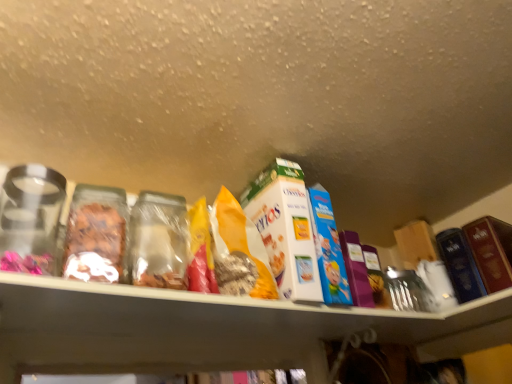
The height and width of the screenshot is (384, 512). What are the coordinates of `white cardboard cereal box at center, which appears as the 2th product when viewed from the right` in the screenshot? It's located at (285, 228).

Measure the distance between point (280, 235) and camera.

Point (280, 235) and camera are 3.29 feet apart from each other.

I want to click on hardcover book at right, acting as the 2th product starting from the left, so click(490, 251).

Is white cardboard cereal box at center, which is counted as the first product, starting from the left, not close to hardcover book at right, marked as the 1th product in a right-to-left arrangement?

No, there isn't a large distance between white cardboard cereal box at center, which is counted as the first product, starting from the left, and hardcover book at right, marked as the 1th product in a right-to-left arrangement.

From a real-world perspective, is white cardboard cereal box at center, which appears as the 2th product when viewed from the right, on hardcover book at right, marked as the 1th product in a right-to-left arrangement?

Yes, from a real-world perspective, white cardboard cereal box at center, which appears as the 2th product when viewed from the right, is above hardcover book at right, marked as the 1th product in a right-to-left arrangement.

Which of these two, white cardboard cereal box at center, which is counted as the first product, starting from the left, or hardcover book at right, marked as the 1th product in a right-to-left arrangement, is bigger?

white cardboard cereal box at center, which is counted as the first product, starting from the left, is bigger.

Can you tell me how much yellow paper bag at center and hardcover book at right, acting as the 2th product starting from the left, differ in facing direction?

The angle between the facing direction of yellow paper bag at center and the facing direction of hardcover book at right, acting as the 2th product starting from the left, is 83.8 degrees.

Is yellow paper bag at center wider than hardcover book at right, marked as the 1th product in a right-to-left arrangement?

No.

Is yellow paper bag at center beside hardcover book at right, marked as the 1th product in a right-to-left arrangement?

yellow paper bag at center is not next to hardcover book at right, marked as the 1th product in a right-to-left arrangement, and they're not touching.

From the image's perspective, count 2nd products downward from the yellow paper bag at center and point to it. Please provide its 2D coordinates.

[(490, 251)]

Where is `cereal above the white cardboard cereal box at center, which is counted as the first product, starting from the left (from the image's perspective)`? Image resolution: width=512 pixels, height=384 pixels. cereal above the white cardboard cereal box at center, which is counted as the first product, starting from the left (from the image's perspective) is located at coordinates (242, 241).

From a real-world perspective, is white cardboard cereal box at center, which appears as the 2th product when viewed from the right, positioned above or below yellow paper bag at center?

Clearly, from a real-world perspective, white cardboard cereal box at center, which appears as the 2th product when viewed from the right, is above yellow paper bag at center.

Does white cardboard cereal box at center, which appears as the 2th product when viewed from the right, come behind yellow paper bag at center?

Yes, white cardboard cereal box at center, which appears as the 2th product when viewed from the right, is further from the viewer.

Considering the relative sizes of white cardboard cereal box at center, which is counted as the first product, starting from the left, and yellow paper bag at center in the image provided, is white cardboard cereal box at center, which is counted as the first product, starting from the left, taller than yellow paper bag at center?

Indeed, white cardboard cereal box at center, which is counted as the first product, starting from the left, has a greater height compared to yellow paper bag at center.

The height and width of the screenshot is (384, 512). I want to click on cereal below the white cardboard cereal box at center, which is counted as the first product, starting from the left (from a real-world perspective), so click(x=242, y=241).

Is yellow paper bag at center not inside white cardboard cereal box at center, which appears as the 2th product when viewed from the right?

yellow paper bag at center is positioned outside white cardboard cereal box at center, which appears as the 2th product when viewed from the right.

Is point (249, 251) positioned after point (312, 286)?

No, (249, 251) is in front of (312, 286).

Is yellow paper bag at center aimed at white cardboard cereal box at center, which is counted as the first product, starting from the left?

No, yellow paper bag at center is not facing towards white cardboard cereal box at center, which is counted as the first product, starting from the left.

From the picture: Is hardcover book at right, acting as the 2th product starting from the left, inside or outside of yellow paper bag at center?

hardcover book at right, acting as the 2th product starting from the left, is spatially situated outside yellow paper bag at center.

From a real-world perspective, is hardcover book at right, acting as the 2th product starting from the left, positioned under yellow paper bag at center based on gravity?

Yes, from a real-world perspective, hardcover book at right, acting as the 2th product starting from the left, is under yellow paper bag at center.

Does point (496, 221) appear closer or farther from the camera than point (264, 255)?

Clearly, point (496, 221) is more distant from the camera than point (264, 255).

Is hardcover book at right, acting as the 2th product starting from the left, facing away from yellow paper bag at center?

No, hardcover book at right, acting as the 2th product starting from the left,'s orientation is not away from yellow paper bag at center.

Based on their positions, is hardcover book at right, marked as the 1th product in a right-to-left arrangement, located to the left or right of white cardboard cereal box at center, which is counted as the first product, starting from the left?

Clearly, hardcover book at right, marked as the 1th product in a right-to-left arrangement, is on the right of white cardboard cereal box at center, which is counted as the first product, starting from the left, in the image.

Consider the image. From the image's perspective, would you say hardcover book at right, acting as the 2th product starting from the left, is shown under white cardboard cereal box at center, which is counted as the first product, starting from the left?

Correct, hardcover book at right, acting as the 2th product starting from the left, appears lower than white cardboard cereal box at center, which is counted as the first product, starting from the left, in the image.

Between hardcover book at right, marked as the 1th product in a right-to-left arrangement, and white cardboard cereal box at center, which appears as the 2th product when viewed from the right, which one has less height?

hardcover book at right, marked as the 1th product in a right-to-left arrangement.

Between hardcover book at right, marked as the 1th product in a right-to-left arrangement, and white cardboard cereal box at center, which appears as the 2th product when viewed from the right, which one is positioned in front?

white cardboard cereal box at center, which appears as the 2th product when viewed from the right, is in front.

In order to click on product located on the left of hardcover book at right, marked as the 1th product in a right-to-left arrangement in this screenshot , I will do `click(285, 228)`.

The image size is (512, 384). I want to click on cereal in front of the hardcover book at right, acting as the 2th product starting from the left, so coord(242,241).

Which object lies nearer to the anchor point hardcover book at right, acting as the 2th product starting from the left, white cardboard cereal box at center, which appears as the 2th product when viewed from the right, or yellow paper bag at center?

white cardboard cereal box at center, which appears as the 2th product when viewed from the right, lies closer to hardcover book at right, acting as the 2th product starting from the left, than the other object.

Which object lies nearer to the anchor point yellow paper bag at center, hardcover book at right, acting as the 2th product starting from the left, or white cardboard cereal box at center, which is counted as the first product, starting from the left?

The object closer to yellow paper bag at center is white cardboard cereal box at center, which is counted as the first product, starting from the left.

Looking at this image, estimate the real-world distances between objects in this image. Which object is closer to hardcover book at right, marked as the 1th product in a right-to-left arrangement, yellow paper bag at center or white cardboard cereal box at center, which is counted as the first product, starting from the left?

white cardboard cereal box at center, which is counted as the first product, starting from the left, lies closer to hardcover book at right, marked as the 1th product in a right-to-left arrangement, than the other object.

Based on their spatial positions, is yellow paper bag at center or hardcover book at right, acting as the 2th product starting from the left, further from white cardboard cereal box at center, which is counted as the first product, starting from the left?

The object further to white cardboard cereal box at center, which is counted as the first product, starting from the left, is hardcover book at right, acting as the 2th product starting from the left.

Which object lies further to the anchor point white cardboard cereal box at center, which appears as the 2th product when viewed from the right, hardcover book at right, marked as the 1th product in a right-to-left arrangement, or yellow paper bag at center?

Based on the image, hardcover book at right, marked as the 1th product in a right-to-left arrangement, appears to be further to white cardboard cereal box at center, which appears as the 2th product when viewed from the right.

From the image, which object appears to be farther from yellow paper bag at center, white cardboard cereal box at center, which is counted as the first product, starting from the left, or hardcover book at right, acting as the 2th product starting from the left?

hardcover book at right, acting as the 2th product starting from the left, lies further to yellow paper bag at center than the other object.

The height and width of the screenshot is (384, 512). In order to click on product located between yellow paper bag at center and hardcover book at right, marked as the 1th product in a right-to-left arrangement, in the left-right direction in this screenshot , I will do `click(285, 228)`.